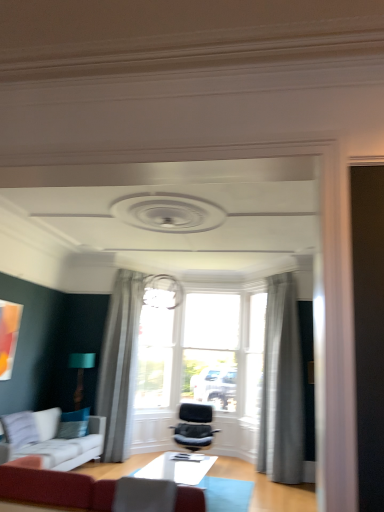
Question: Considering the positions of point (72, 355) and point (124, 437), is point (72, 355) closer or farther from the camera than point (124, 437)?

Choices:
 (A) farther
 (B) closer

Answer: (A)

Question: Is teal fabric lampshade at lower left in front of or behind gray sheer curtain at center, arranged as the 2th curtain when viewed from the right, in the image?

Choices:
 (A) front
 (B) behind

Answer: (B)

Question: Based on their relative distances, which object is farther from the white fabric couch at lower left, which appears as the 1th studio couch when viewed from the left?

Choices:
 (A) sheer gray curtain at upper center, arranged as the 1th curtain when viewed from the right
 (B) gray sheer curtain at center, marked as the 1th curtain in a left-to-right arrangement
 (C) white glossy table at center
 (D) velvet red sofa at lower left, the second studio couch from the left
 (E) teal fabric lampshade at lower left

Answer: (A)

Question: Considering the real-world distances, which object is closest to the white fabric couch at lower left, marked as the 2th studio couch in a front-to-back arrangement?

Choices:
 (A) velvet red sofa at lower left, marked as the 1th studio couch in a right-to-left arrangement
 (B) gray sheer curtain at center, arranged as the 2th curtain when viewed from the right
 (C) velvet black chair at center
 (D) sheer gray curtain at upper center, arranged as the 1th curtain when viewed from the right
 (E) white glossy table at center

Answer: (B)